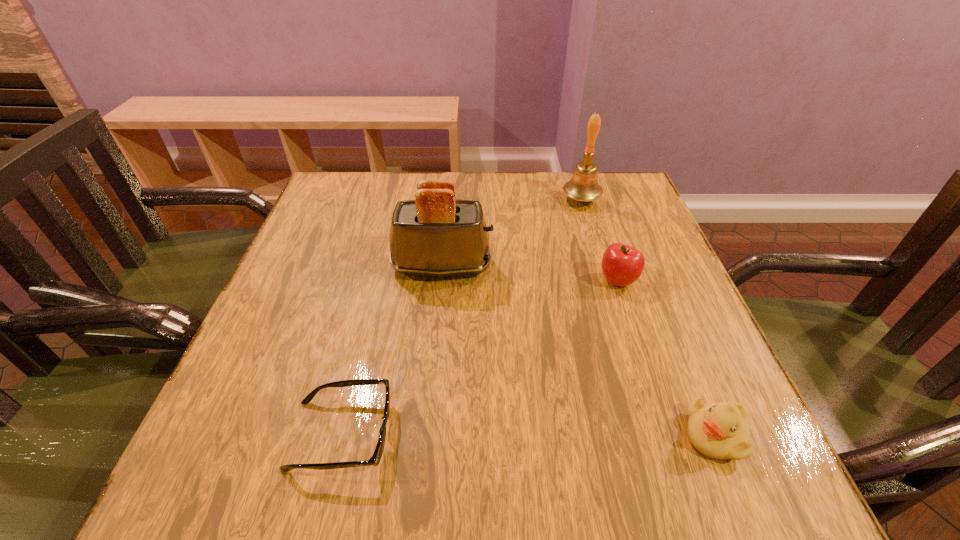
Where is `object that stands as the second closest to the shortest object`? The width and height of the screenshot is (960, 540). object that stands as the second closest to the shortest object is located at coordinates (721, 431).

Find the location of `vacant space that satisfies the following two spatial constraints: 1. on the front side of the bell; 2. on the right side of the third tallest object`. vacant space that satisfies the following two spatial constraints: 1. on the front side of the bell; 2. on the right side of the third tallest object is located at coordinates (606, 280).

Where is `vacant space that satisfies the following two spatial constraints: 1. on the side of the toaster with the control lever; 2. on the left side of the apple`? This screenshot has height=540, width=960. vacant space that satisfies the following two spatial constraints: 1. on the side of the toaster with the control lever; 2. on the left side of the apple is located at coordinates (441, 280).

The height and width of the screenshot is (540, 960). What are the coordinates of `free space that satisfies the following two spatial constraints: 1. on the side of the toaster with the control lever; 2. on the back side of the third shortest object` in the screenshot? It's located at (441, 280).